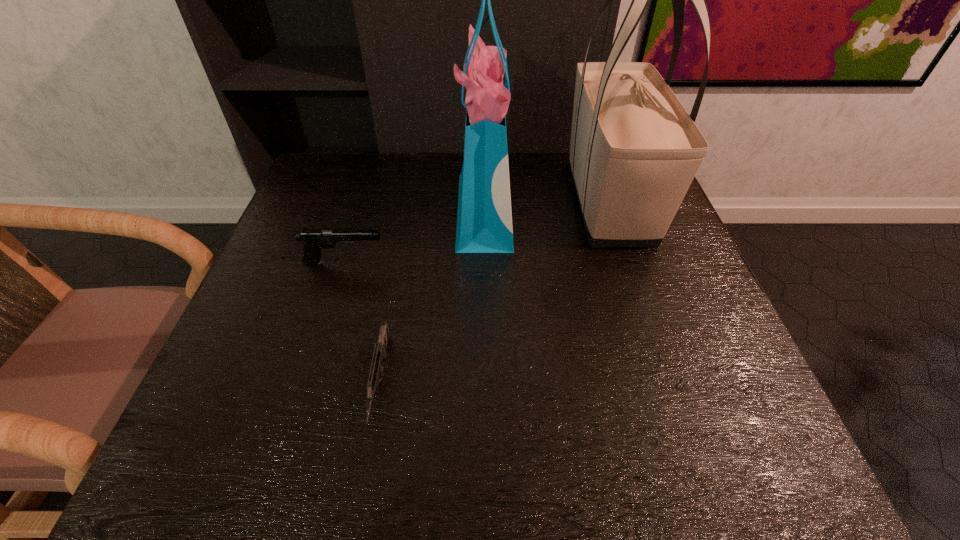
You are a GUI agent. You are given a task and a screenshot of the screen. Output one action in this format:
    pyautogui.click(x=<x>, y=<y>)
    Task: Click on the rightmost object
    The image size is (960, 540).
    Given the screenshot: What is the action you would take?
    pyautogui.click(x=634, y=151)

Where is `the left shopping bag`? This screenshot has height=540, width=960. the left shopping bag is located at coordinates (x=484, y=220).

The image size is (960, 540). I want to click on the farther gun, so click(x=314, y=240).

Where is `the left gun`? This screenshot has width=960, height=540. the left gun is located at coordinates (314, 240).

Find the location of `the nearer gun`. the nearer gun is located at coordinates 380,352.

Locate an element on the screen. the shortest object is located at coordinates (380, 352).

Where is `free space located with handles facing forward on the rightmost object`? Image resolution: width=960 pixels, height=540 pixels. free space located with handles facing forward on the rightmost object is located at coordinates (682, 417).

Locate an element on the screen. The image size is (960, 540). vacant region located 0.140m on the front of the left shopping bag is located at coordinates (485, 306).

This screenshot has height=540, width=960. What are the coordinates of `vacant space located 0.350m at the aiming end of the taller gun` in the screenshot? It's located at (542, 262).

I want to click on object located in the near edge section of the desktop, so click(x=380, y=352).